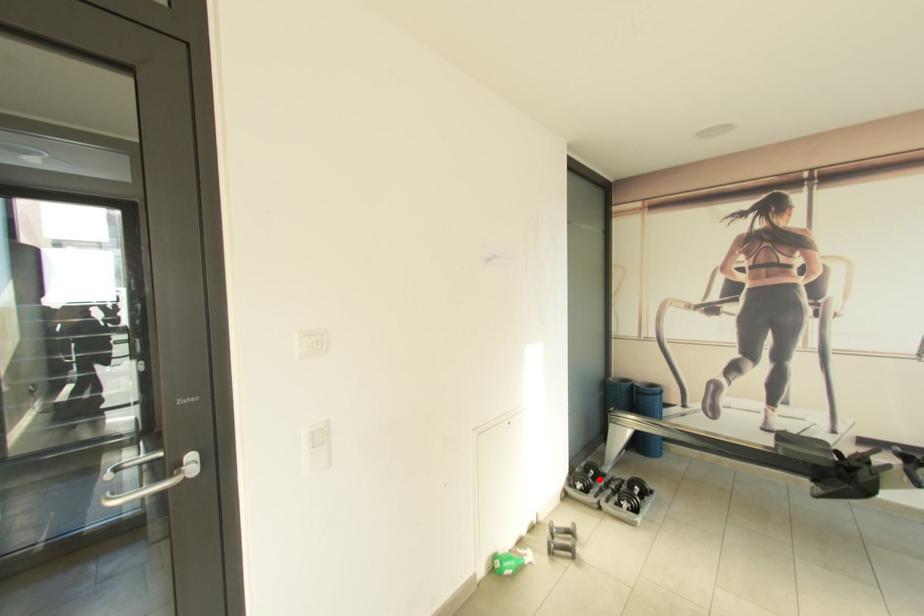
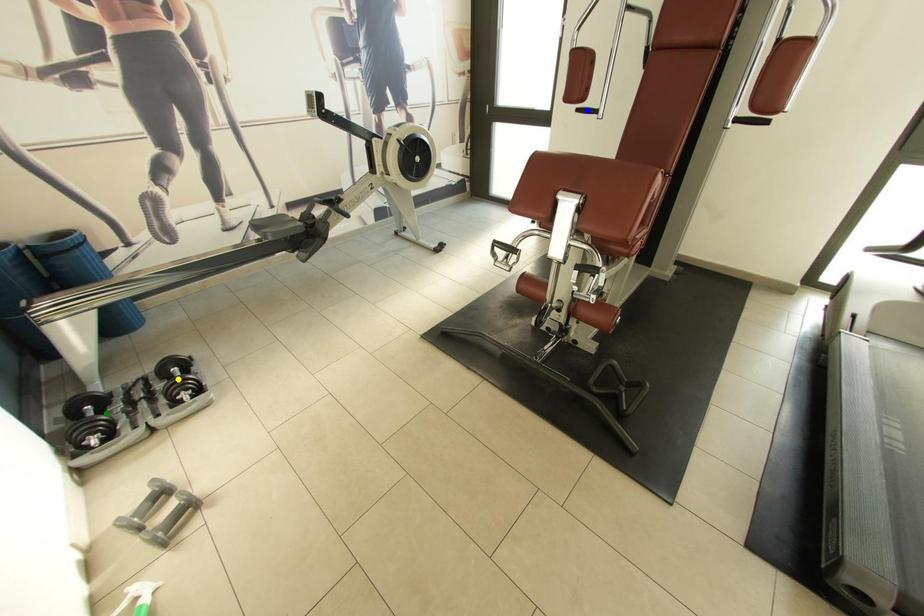
Question: I am providing you with two images of the same scene from different viewpoints. A red point is marked on the first image. You are given multiple points on the second image. Which point in image 2 represents the same 3d spot as the red point in image 1?

Choices:
 (A) blue point
 (B) yellow point
 (C) green point

Answer: (C)